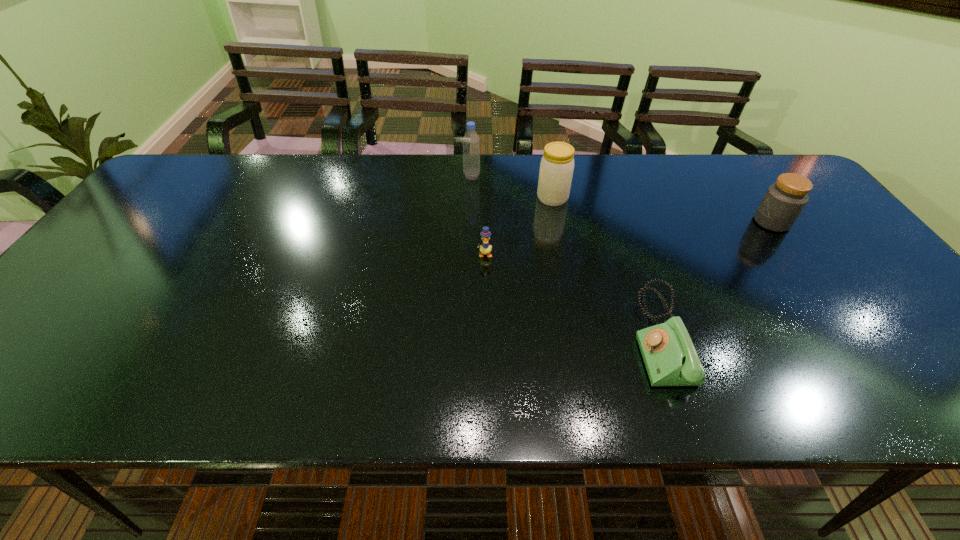
At what (x,y) coordinates should I click in order to perform the action: click on free area in between the second farthest object and the fourth object from left to right. Please return your answer as a coordinate pair (x, y). Image resolution: width=960 pixels, height=540 pixels. Looking at the image, I should click on (606, 267).

You are a GUI agent. You are given a task and a screenshot of the screen. Output one action in this format:
    pyautogui.click(x=<x>, y=<y>)
    Task: Click on the free space between the farther jar and the shorter jar
    
    Given the screenshot: What is the action you would take?
    pyautogui.click(x=662, y=210)

In order to click on vacant region between the shorter jar and the second farthest object in this screenshot , I will do `click(662, 210)`.

You are a GUI agent. You are given a task and a screenshot of the screen. Output one action in this format:
    pyautogui.click(x=<x>, y=<y>)
    Task: Click on the vacant area between the telephone and the second nearest object
    Image resolution: width=960 pixels, height=540 pixels.
    Given the screenshot: What is the action you would take?
    pyautogui.click(x=572, y=295)

Locate which object is the fourth closest to the fourth farthest object. Please provide its 2D coordinates. Your answer should be formatted as a tuple, i.e. [(x, y)], where the tuple contains the x and y coordinates of a point satisfying the conditions above.

[(784, 200)]

The width and height of the screenshot is (960, 540). Identify the location of object that is the second closest one to the fourth object from left to right. (557, 164).

This screenshot has width=960, height=540. In order to click on blank space that satisfies the following two spatial constraints: 1. on the surface of the rightmost object near the warning symbol; 2. on the face of the duckling, where the monocle is placed in this screenshot , I will do (x=795, y=254).